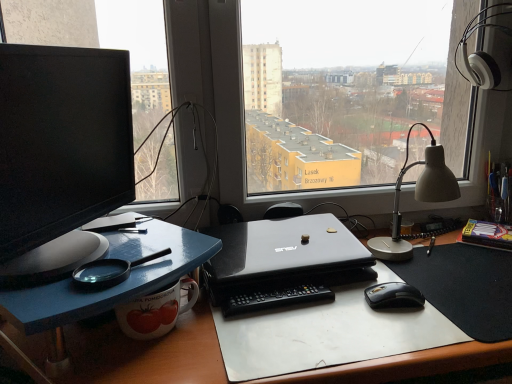
Where is `blank space situated above black rubber mousepad at lower right (from a real-world perspective)`? blank space situated above black rubber mousepad at lower right (from a real-world perspective) is located at coordinates (466, 272).